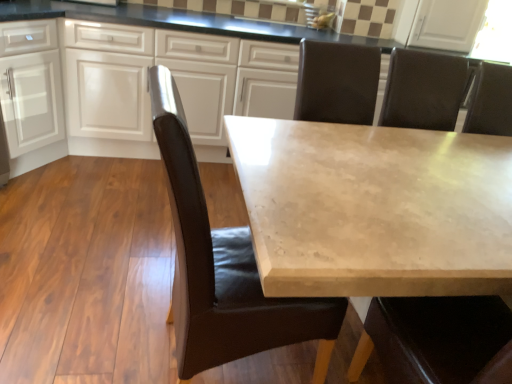
Question: Would you say white glossy cabinets at upper center, which is counted as the 1th cabinetry, starting from the right, is outside brown leather chair at center?

Choices:
 (A) yes
 (B) no

Answer: (A)

Question: Is white glossy cabinets at upper center, which is the 2th cabinetry in left-to-right order, far away from brown leather chair at center?

Choices:
 (A) yes
 (B) no

Answer: (A)

Question: Can you confirm if white glossy cabinets at upper center, which is the 2th cabinetry in left-to-right order, is positioned to the left of brown leather chair at center?

Choices:
 (A) no
 (B) yes

Answer: (B)

Question: Is the depth of white glossy cabinets at upper center, which is the 2th cabinetry in left-to-right order, greater than that of brown leather chair at center?

Choices:
 (A) no
 (B) yes

Answer: (B)

Question: Considering the relative sizes of white glossy cabinets at upper center, which is counted as the 1th cabinetry, starting from the right, and brown leather chair at center in the image provided, is white glossy cabinets at upper center, which is counted as the 1th cabinetry, starting from the right, bigger than brown leather chair at center?

Choices:
 (A) no
 (B) yes

Answer: (B)

Question: Relative to white glossy cabinets at upper center, which is counted as the 1th cabinetry, starting from the right, is brown leather chair at center in front or behind?

Choices:
 (A) behind
 (B) front

Answer: (B)

Question: In terms of width, does brown leather chair at center look wider or thinner when compared to white glossy cabinets at upper center, which is counted as the 1th cabinetry, starting from the right?

Choices:
 (A) wide
 (B) thin

Answer: (B)

Question: In terms of height, does brown leather chair at center look taller or shorter compared to white glossy cabinets at upper center, which is the 2th cabinetry in left-to-right order?

Choices:
 (A) tall
 (B) short

Answer: (A)

Question: Considering the positions of point (183, 211) and point (15, 44), is point (183, 211) closer or farther from the camera than point (15, 44)?

Choices:
 (A) closer
 (B) farther

Answer: (A)

Question: From a real-world perspective, is white glossy cabinets at upper center, which is counted as the 1th cabinetry, starting from the right, positioned above or below white matte cabinet at left, arranged as the 2th cabinetry when viewed from the right?

Choices:
 (A) below
 (B) above

Answer: (B)

Question: Considering the positions of white glossy cabinets at upper center, which is counted as the 1th cabinetry, starting from the right, and white matte cabinet at left, the 1th cabinetry viewed from the left, in the image, is white glossy cabinets at upper center, which is counted as the 1th cabinetry, starting from the right, taller or shorter than white matte cabinet at left, the 1th cabinetry viewed from the left,?

Choices:
 (A) short
 (B) tall

Answer: (A)

Question: Considering the positions of white glossy cabinets at upper center, which is counted as the 1th cabinetry, starting from the right, and white matte cabinet at left, arranged as the 2th cabinetry when viewed from the right, in the image, is white glossy cabinets at upper center, which is counted as the 1th cabinetry, starting from the right, wider or thinner than white matte cabinet at left, arranged as the 2th cabinetry when viewed from the right,?

Choices:
 (A) thin
 (B) wide

Answer: (B)

Question: From the image's perspective, relative to white matte cabinet at left, arranged as the 2th cabinetry when viewed from the right, is white glossy cabinets at upper center, which is counted as the 1th cabinetry, starting from the right, above or below?

Choices:
 (A) above
 (B) below

Answer: (B)

Question: Does point (119, 72) appear closer or farther from the camera than point (292, 261)?

Choices:
 (A) farther
 (B) closer

Answer: (A)

Question: Considering the relative positions of white glossy cabinets at upper center, which is counted as the 1th cabinetry, starting from the right, and beige marble table at center in the image provided, is white glossy cabinets at upper center, which is counted as the 1th cabinetry, starting from the right, to the left or to the right of beige marble table at center?

Choices:
 (A) left
 (B) right

Answer: (A)